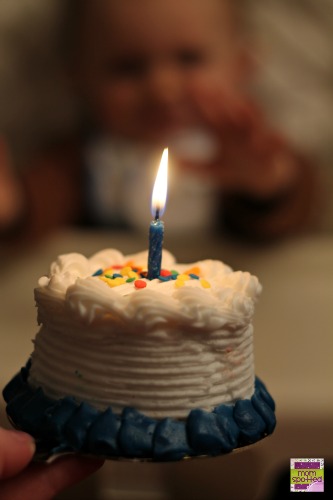
In order to click on candle in this screenshot , I will do `click(158, 247)`.